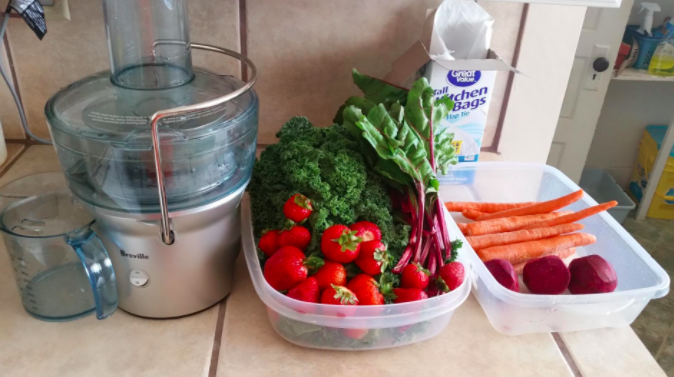
Image resolution: width=674 pixels, height=377 pixels. In order to click on door in this screenshot , I will do `click(586, 115)`.